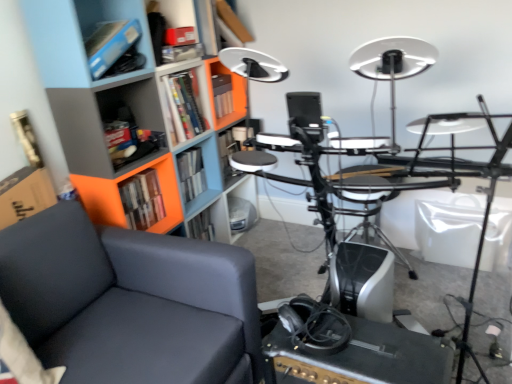
Question: Is hardcover book at center, positioned as the 1th book in back-to-front order, situated inside orange plastic bookcase at left or outside?

Choices:
 (A) inside
 (B) outside

Answer: (A)

Question: In terms of width, does hardcover book at center, marked as the 2th book in a front-to-back arrangement, look wider or thinner when compared to orange plastic bookcase at left?

Choices:
 (A) thin
 (B) wide

Answer: (A)

Question: Which object is positioned farthest from the matte plastic shelf at upper center, marked as the second shelf in a front-to-back arrangement?

Choices:
 (A) matte plastic shelf at center, marked as the 3th shelf in a front-to-back arrangement
 (B) black matte amplifier at lower center
 (C) orange plastic bookcase at left
 (D) matte black chair at left
 (E) hardcover book at center, the second book from the back

Answer: (B)

Question: Which of these objects is positioned farthest from the matte plastic shelf at center, positioned as the 3th shelf in bottom-to-top order?

Choices:
 (A) black plastic computer desk at center
 (B) hardcover book at center, the second book from the back
 (C) matte plastic shelf at lower center, which is counted as the first shelf, starting from the back
 (D) orange plastic bookcase at left
 (E) black matte amplifier at lower center

Answer: (E)